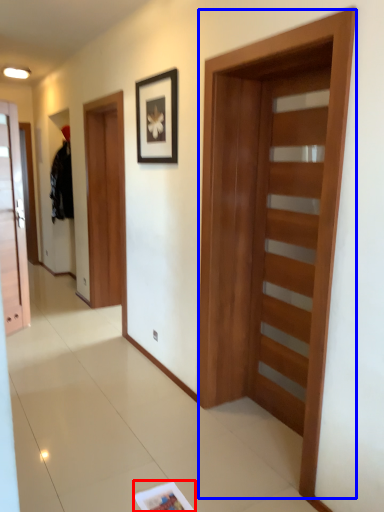
Question: Among these objects, which one is farthest to the camera, magazine (highlighted by a red box) or barn door (highlighted by a blue box)?

Choices:
 (A) magazine
 (B) barn door

Answer: (A)